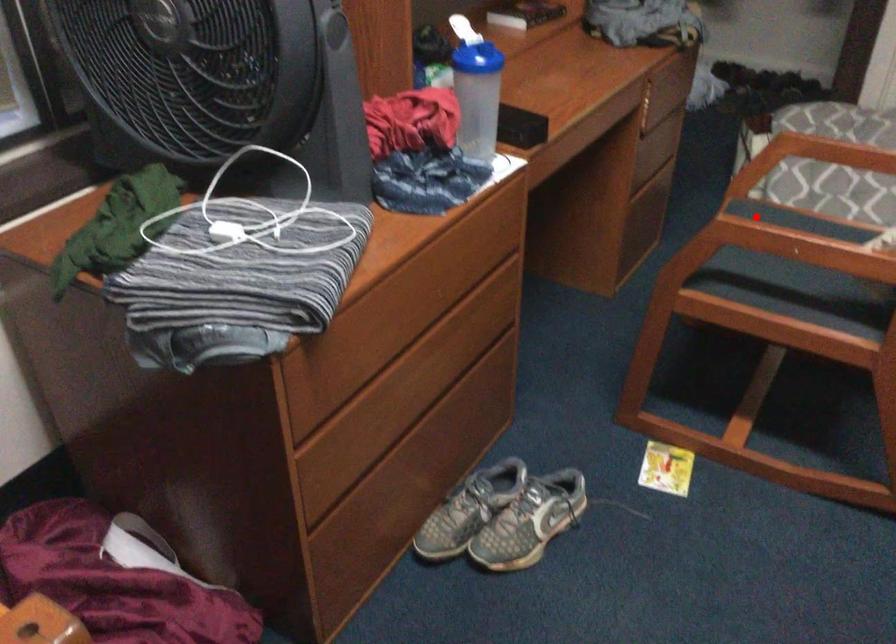
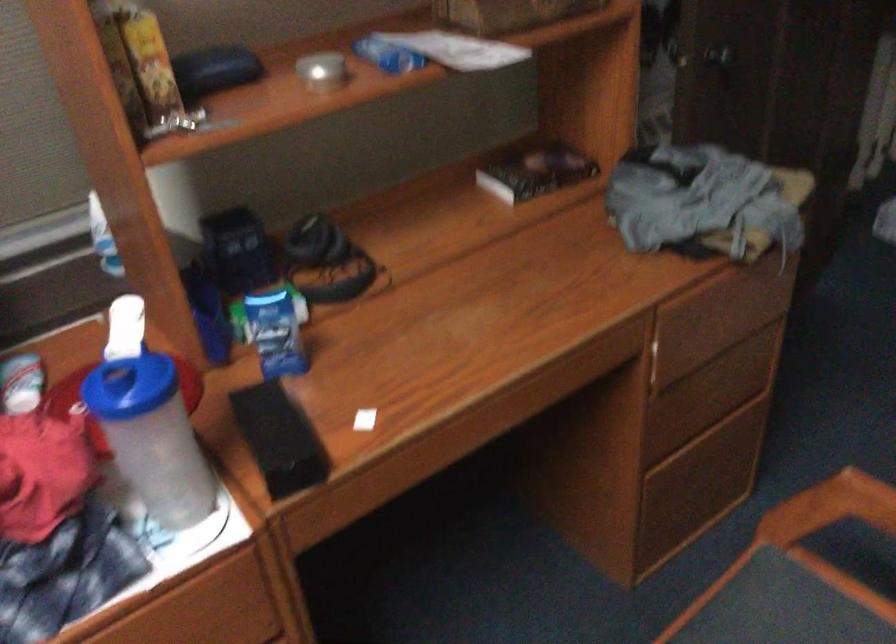
Find the pixel in the second image that matches the highlighted location in the first image.

(780, 614)